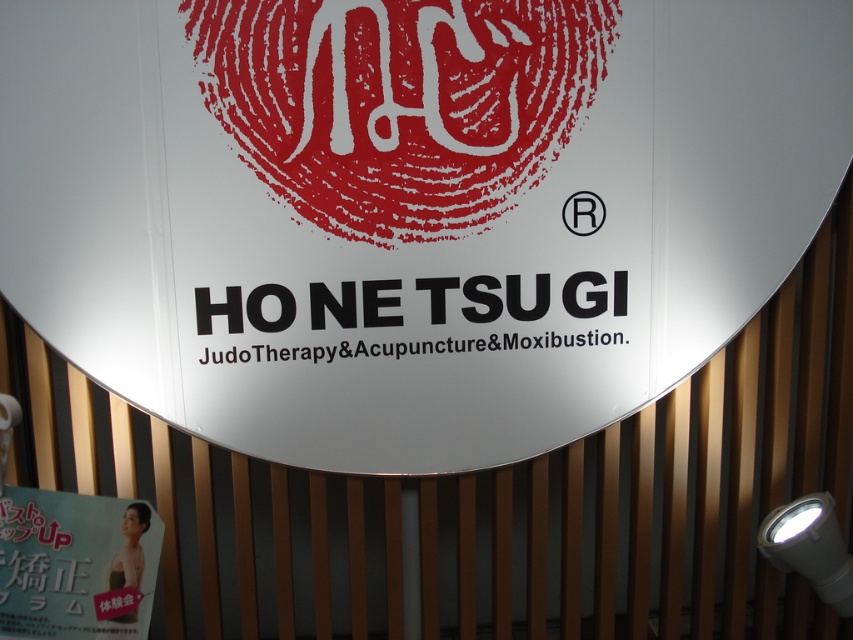
Is point (239, 48) farther from viewer compared to point (593, 218)?

That is False.

Who is lower down, white matte logo at upper center or black registered trademark symbol at upper center?

black registered trademark symbol at upper center is below.

Identify the location of white matte logo at upper center. Image resolution: width=853 pixels, height=640 pixels. (399, 102).

The height and width of the screenshot is (640, 853). What are the coordinates of `white matte logo at upper center` in the screenshot? It's located at (399, 102).

Is white glossy poster at lower left positioned before white plastic spotlight at lower right?

Yes.

Can you confirm if white glossy poster at lower left is positioned to the right of white plastic spotlight at lower right?

In fact, white glossy poster at lower left is to the left of white plastic spotlight at lower right.

Locate an element on the screen. white glossy poster at lower left is located at coordinates (74, 564).

Is point (74, 605) closer to camera compared to point (572, 214)?

Yes, point (74, 605) is in front of point (572, 214).

Is white glossy poster at lower left to the left of black registered trademark symbol at upper center from the viewer's perspective?

Yes, white glossy poster at lower left is to the left of black registered trademark symbol at upper center.

Is point (97, 582) positioned after point (563, 204)?

That is False.

Where is `white glossy poster at lower left`? The height and width of the screenshot is (640, 853). white glossy poster at lower left is located at coordinates (74, 564).